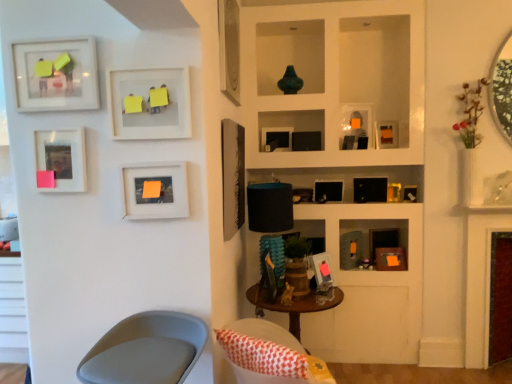
Question: Can you confirm if maroon velvet fireplace at right is positioned to the right of matte orange picture frame at center-right, which appears as the 11th picture frame when viewed from the left?

Choices:
 (A) yes
 (B) no

Answer: (A)

Question: Considering the relative positions of maroon velvet fireplace at right and matte orange picture frame at center-right, which ranks as the 3th picture frame in right-to-left order, in the image provided, is maroon velvet fireplace at right behind matte orange picture frame at center-right, which ranks as the 3th picture frame in right-to-left order,?

Choices:
 (A) no
 (B) yes

Answer: (A)

Question: Considering the relative positions of maroon velvet fireplace at right and matte orange picture frame at center-right, which ranks as the 3th picture frame in right-to-left order, in the image provided, is maroon velvet fireplace at right to the left of matte orange picture frame at center-right, which ranks as the 3th picture frame in right-to-left order, from the viewer's perspective?

Choices:
 (A) no
 (B) yes

Answer: (A)

Question: From the image's perspective, is maroon velvet fireplace at right under matte orange picture frame at center-right, which appears as the 11th picture frame when viewed from the left?

Choices:
 (A) no
 (B) yes

Answer: (B)

Question: Considering the relative sizes of maroon velvet fireplace at right and matte orange picture frame at center-right, which appears as the 11th picture frame when viewed from the left, in the image provided, is maroon velvet fireplace at right smaller than matte orange picture frame at center-right, which appears as the 11th picture frame when viewed from the left,?

Choices:
 (A) no
 (B) yes

Answer: (A)

Question: Considering the relative positions of metallic silver mirror at upper right and black matte picture frame at upper right, the 10th picture frame positioned from the left, in the image provided, is metallic silver mirror at upper right to the left or to the right of black matte picture frame at upper right, the 10th picture frame positioned from the left,?

Choices:
 (A) left
 (B) right

Answer: (B)

Question: From the image's perspective, is metallic silver mirror at upper right located above or below black matte picture frame at upper right, the 10th picture frame positioned from the left?

Choices:
 (A) above
 (B) below

Answer: (A)

Question: Is metallic silver mirror at upper right wider or thinner than black matte picture frame at upper right, placed as the fourth picture frame when sorted from right to left?

Choices:
 (A) thin
 (B) wide

Answer: (A)

Question: From a real-world perspective, is metallic silver mirror at upper right positioned above or below black matte picture frame at upper right, placed as the fourth picture frame when sorted from right to left?

Choices:
 (A) above
 (B) below

Answer: (A)

Question: Would you say matte black picture frame at upper center, the 9th picture frame when ordered from left to right, is to the left or to the right of matte wood picture frame at center, the tenth picture frame in the right-to-left sequence, in the picture?

Choices:
 (A) left
 (B) right

Answer: (B)

Question: Is matte black picture frame at upper center, which is counted as the fifth picture frame, starting from the right, inside or outside of matte wood picture frame at center, the tenth picture frame in the right-to-left sequence?

Choices:
 (A) inside
 (B) outside

Answer: (B)

Question: From the image's perspective, is matte black picture frame at upper center, which is counted as the fifth picture frame, starting from the right, positioned above or below matte wood picture frame at center, the tenth picture frame in the right-to-left sequence?

Choices:
 (A) below
 (B) above

Answer: (B)

Question: Considering the positions of matte black picture frame at upper center, the 9th picture frame when ordered from left to right, and matte wood picture frame at center, the fourth picture frame when ordered from left to right, in the image, is matte black picture frame at upper center, the 9th picture frame when ordered from left to right, bigger or smaller than matte wood picture frame at center, the fourth picture frame when ordered from left to right,?

Choices:
 (A) big
 (B) small

Answer: (B)

Question: Is matte black picture frame at center, positioned as the 7th picture frame in left-to-right order, taller or shorter than maroon velvet fireplace at right?

Choices:
 (A) tall
 (B) short

Answer: (B)

Question: From the image's perspective, is matte black picture frame at center, positioned as the seventh picture frame in right-to-left order, located above or below maroon velvet fireplace at right?

Choices:
 (A) above
 (B) below

Answer: (A)